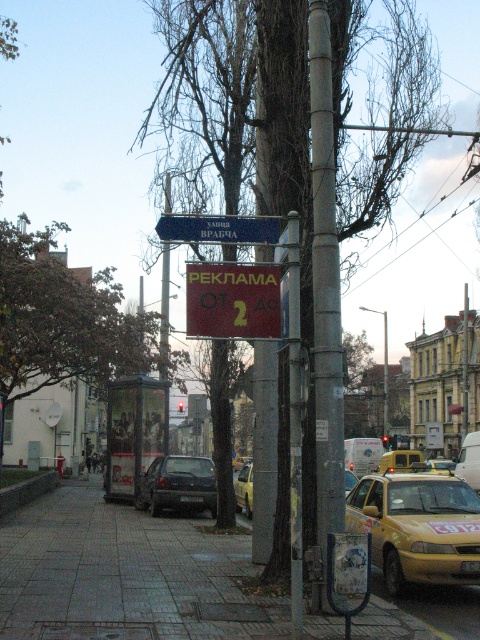
You are a pedestrian trying to read both the blue plastic sign at upper center and the metallic silver parking sign at lower center. Which one do you need to look up to see?

The blue plastic sign at upper center is located above the metallic silver parking sign at lower center, so you need to look up to see the blue plastic sign at upper center.

You are a pedestrian trying to cross the street safely. You notice two yellow matte taxis in the image. Which one is closer to you, the yellow matte taxi at lower right or the yellow matte taxi at center?

The yellow matte taxi at lower right is closer to you because it is positioned over the yellow matte taxi at center, indicating it is in front.

You are a city planner reviewing this urban scene. You need to determine which object occupies more space in the image between the gray concrete sidewalk at center and the red plastic sign at center. Which one is larger?

The gray concrete sidewalk at center is bigger than the red plastic sign at center, so the sidewalk occupies more space in the image.